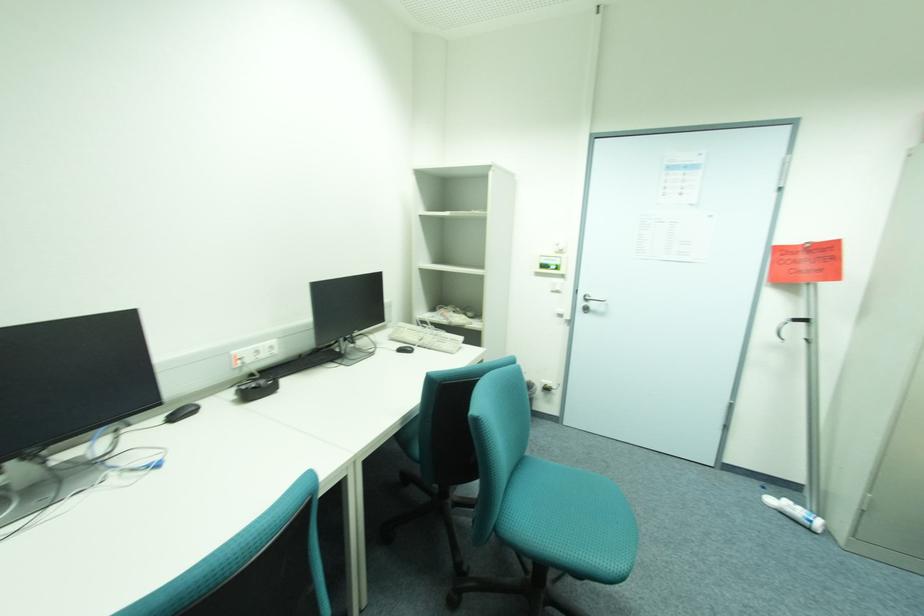
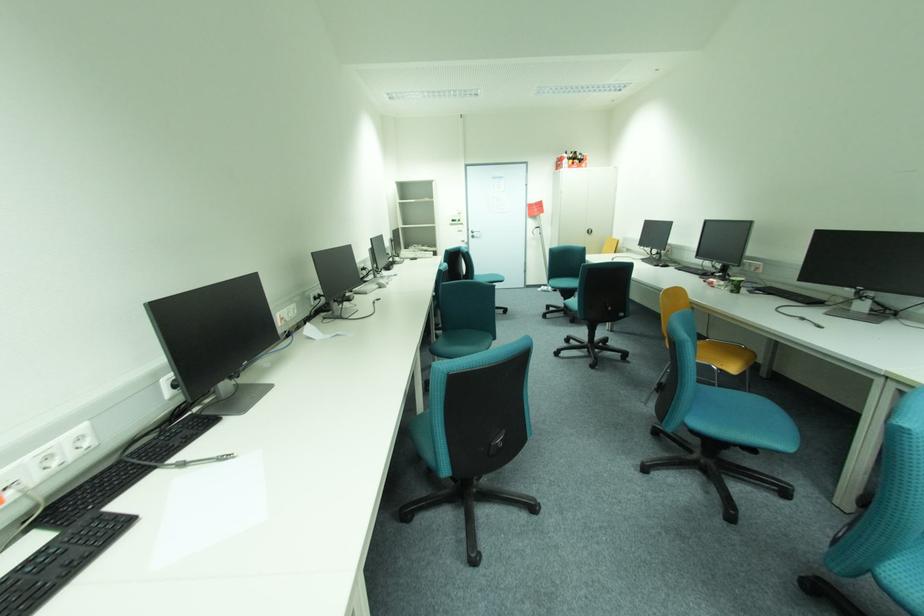
The point at (589, 304) is marked in the first image. Where is the corresponding point in the second image?

(477, 235)